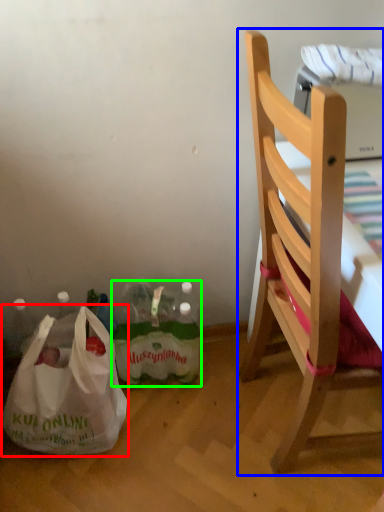
Question: Based on their relative distances, which object is farther from plastic bag (highlighted by a red box)? Choose from chair (highlighted by a blue box) and bottle (highlighted by a green box).

Choices:
 (A) chair
 (B) bottle

Answer: (A)